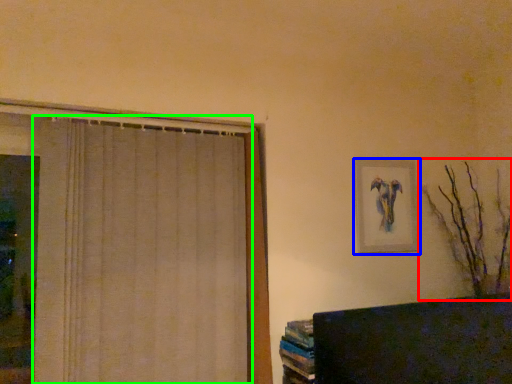
Question: Considering the real-world distances, which object is closest to branch (highlighted by a red box)? picture frame (highlighted by a blue box) or curtain (highlighted by a green box).

Choices:
 (A) picture frame
 (B) curtain

Answer: (A)